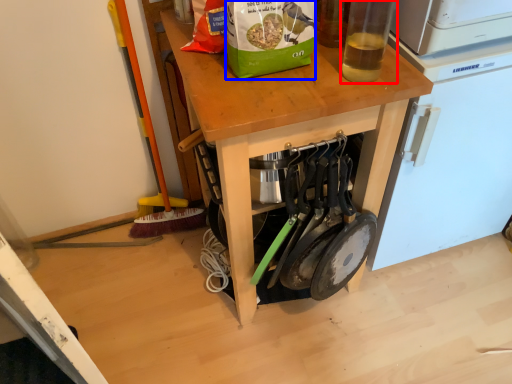
Question: Among these objects, which one is farthest to the camera, bottle (highlighted by a red box) or paper bag (highlighted by a blue box)?

Choices:
 (A) bottle
 (B) paper bag

Answer: (B)